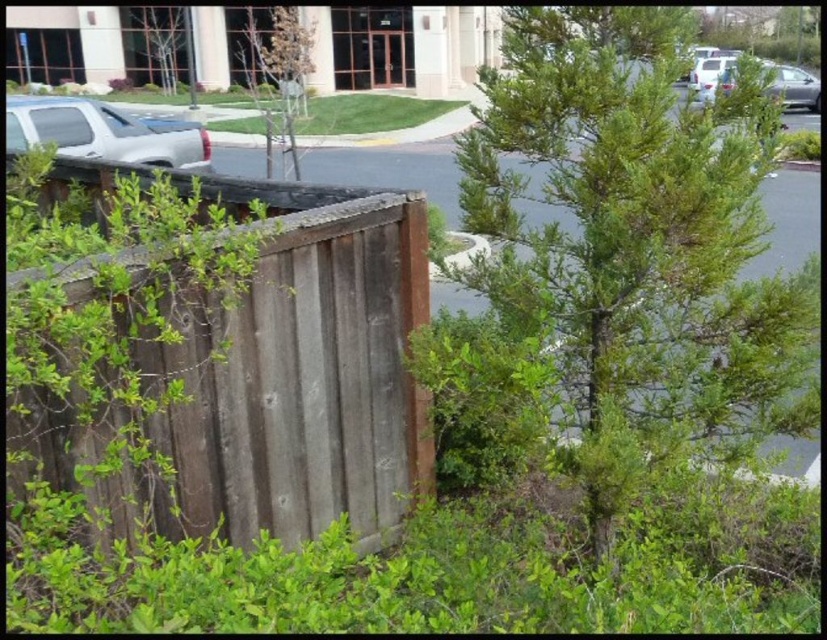
Is green leafy tree at center taller than silver metallic truck at left?

Indeed, green leafy tree at center has a greater height compared to silver metallic truck at left.

Is green leafy tree at center behind silver metallic truck at left?

That is False.

In the scene shown: Who is more distant from viewer, (598, 125) or (96, 144)?

Point (96, 144)

Where is `green leafy tree at center`? green leafy tree at center is located at coordinates (639, 243).

Is point (180, 131) farther from camera compared to point (151, 74)?

No, it is in front of (151, 74).

Who is more forward, (110, 157) or (123, 36)?

Point (110, 157) is in front.

Who is more forward, [168,138] or [151,20]?

Positioned in front is point [168,138].

Find the location of a particular element. Image resolution: width=827 pixels, height=640 pixels. silver metallic truck at left is located at coordinates pyautogui.click(x=104, y=132).

Is green leafy tree at center closer to the viewer compared to weathered wood fence at left?

Yes, it is.

You are a GUI agent. You are given a task and a screenshot of the screen. Output one action in this format:
    pyautogui.click(x=<x>, y=<y>)
    Task: Click on the green leafy tree at center
    
    Given the screenshot: What is the action you would take?
    pyautogui.click(x=639, y=243)

Where is `green leafy tree at center`? green leafy tree at center is located at coordinates (639, 243).